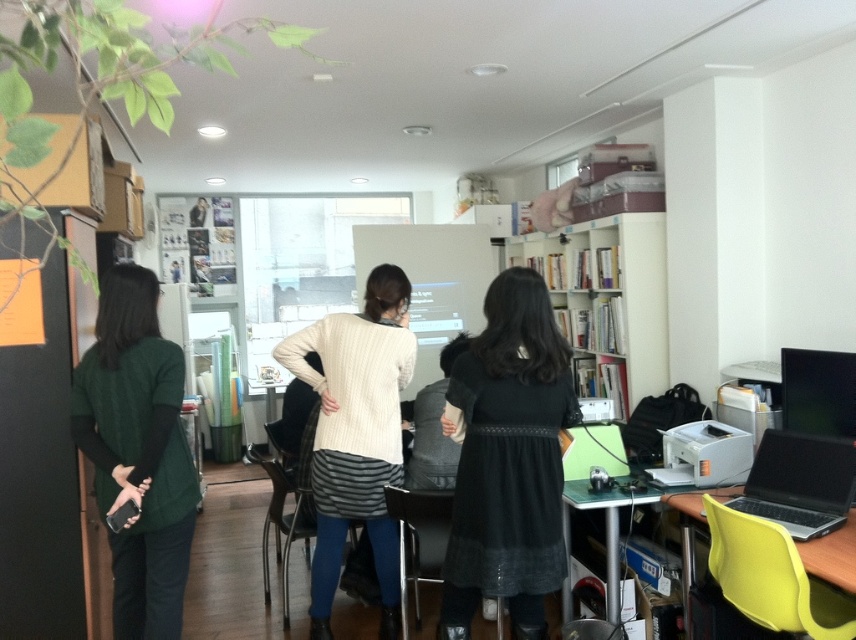
You are a GUI agent. You are given a task and a screenshot of the screen. Output one action in this format:
    pyautogui.click(x=<x>, y=<y>)
    Task: Click on the black matte dress at center
    
    Given the screenshot: What is the action you would take?
    pyautogui.click(x=507, y=460)

Which of these two, black matte dress at center or silver metallic laptop at lower right, stands taller?

Standing taller between the two is black matte dress at center.

Is point (492, 492) farther from camera compared to point (771, 490)?

No, it is not.

I want to click on black matte dress at center, so click(x=507, y=460).

Is green knitted sweater at left positioned before white glossy bookshelf at upper center?

Yes, it is in front of white glossy bookshelf at upper center.

Which is behind, point (158, 563) or point (651, 346)?

Positioned behind is point (651, 346).

Who is more forward, (x=180, y=452) or (x=587, y=248)?

Point (x=180, y=452) is in front.

The image size is (856, 640). I want to click on green knitted sweater at left, so click(137, 452).

Does black matte dress at center have a greater height compared to white knitted sweater at center?

No.

Does black matte dress at center have a larger size compared to white knitted sweater at center?

Incorrect, black matte dress at center is not larger than white knitted sweater at center.

Image resolution: width=856 pixels, height=640 pixels. Describe the element at coordinates (507, 460) in the screenshot. I see `black matte dress at center` at that location.

At what (x,y) coordinates should I click in order to perform the action: click on black matte dress at center. Please return your answer as a coordinate pair (x, y). The image size is (856, 640). Looking at the image, I should click on (507, 460).